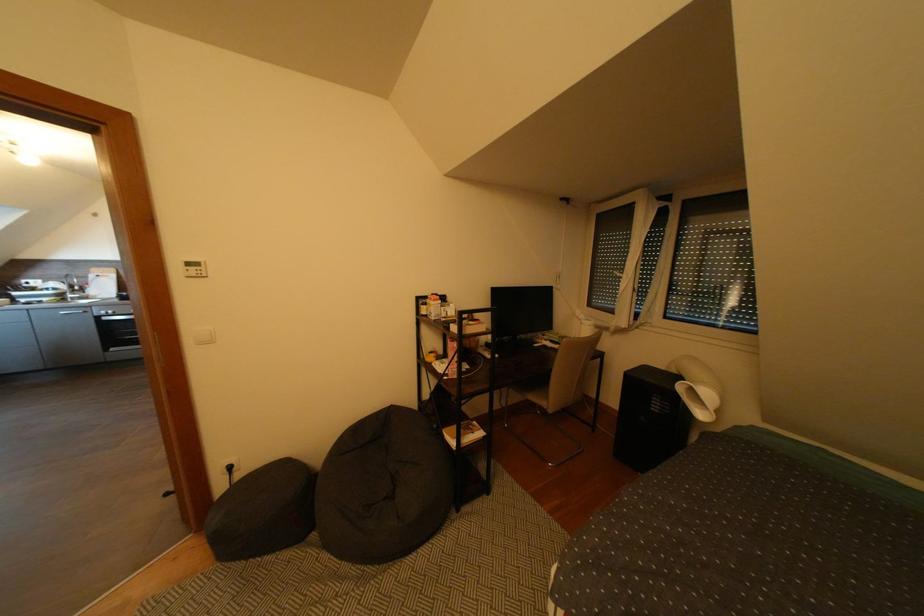
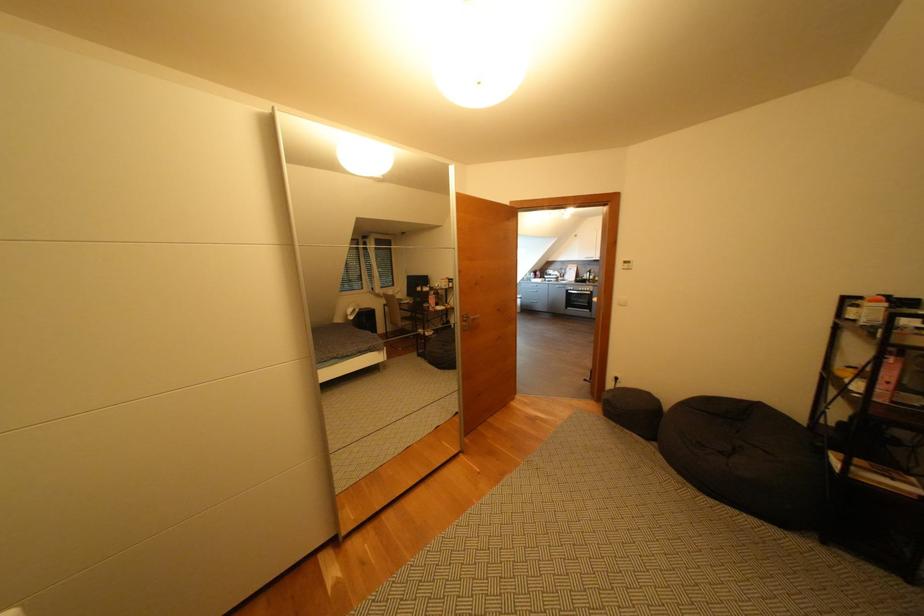
Question: The images are taken continuously from a first-person perspective. In which direction is your viewpoint rotating?

Choices:
 (A) Left
 (B) Right
 (C) Up
 (D) Down

Answer: (A)